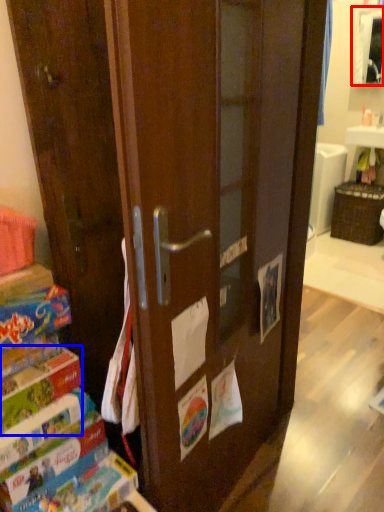
Question: Among these objects, which one is farthest to the camera, cabinetry (highlighted by a red box) or paperback book (highlighted by a blue box)?

Choices:
 (A) cabinetry
 (B) paperback book

Answer: (A)